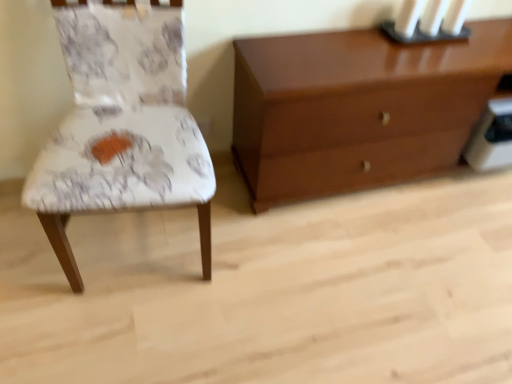
You are a GUI agent. You are given a task and a screenshot of the screen. Output one action in this format:
    pyautogui.click(x=<x>, y=<y>)
    Task: Click on the unoccupied area in front of black matte candle holder at upper right
    This screenshot has width=512, height=384.
    Given the screenshot: What is the action you would take?
    pyautogui.click(x=421, y=57)